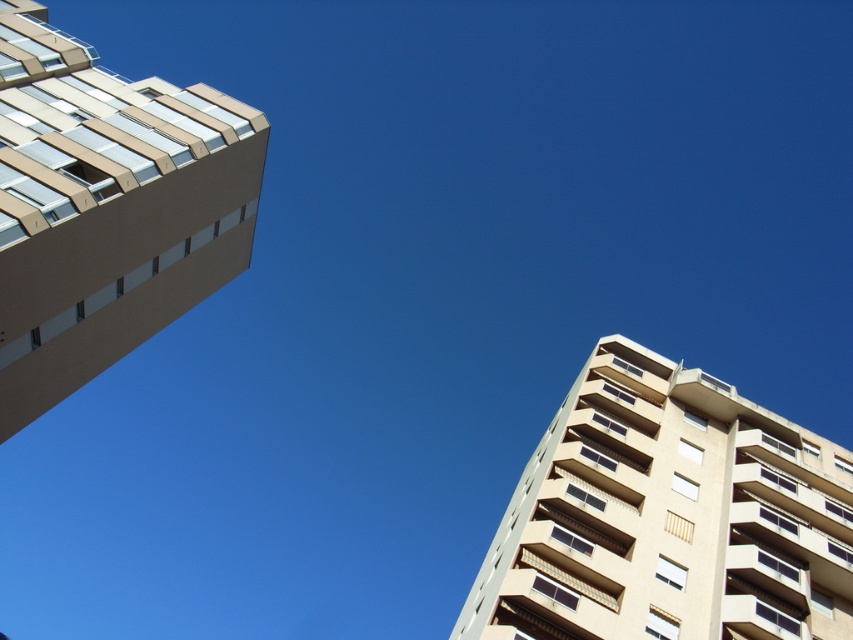
You are standing at the center of the image and looking upward. Which direction should you turn to face the beige concrete building at right?

You should turn to your right to face the beige concrete building at right since it is located at the right side of the image.

You are standing on the street looking up at the two beige concrete buildings. Which building is closer to you, the beige concrete building at right or the beige concrete building at left?

The beige concrete building at right is closer to you because it is further to the viewer than the beige concrete building at left.